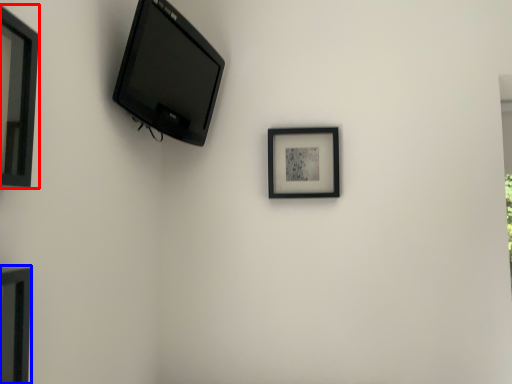
Question: Which of the following is the farthest to the observer, picture frame (highlighted by a red box) or picture frame (highlighted by a blue box)?

Choices:
 (A) picture frame
 (B) picture frame

Answer: (A)